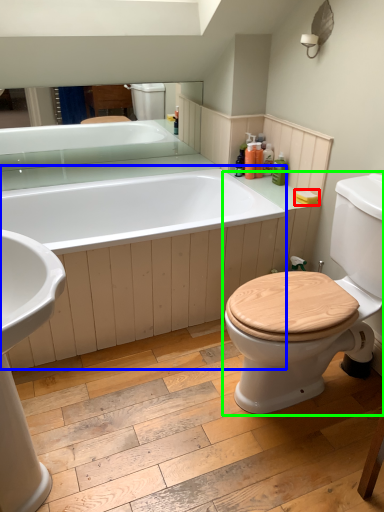
Question: Estimate the real-world distances between objects in this image. Which object is farther from toilet paper (highlighted by a red box), bath (highlighted by a blue box) or toilet (highlighted by a green box)?

Choices:
 (A) bath
 (B) toilet

Answer: (A)